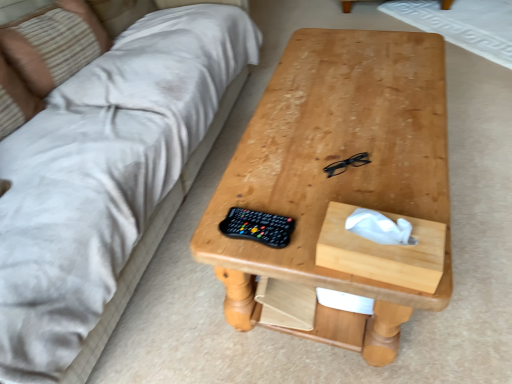
Find the location of a particular element. The height and width of the screenshot is (384, 512). unoccupied space behind black plastic glasses at center is located at coordinates (338, 130).